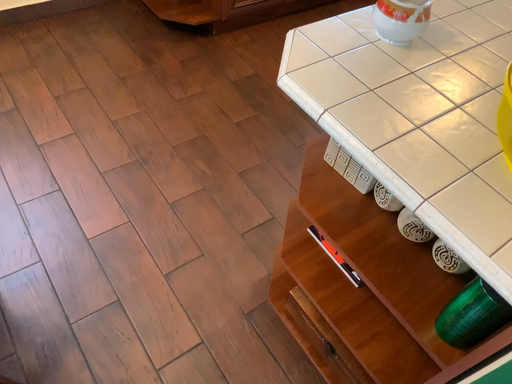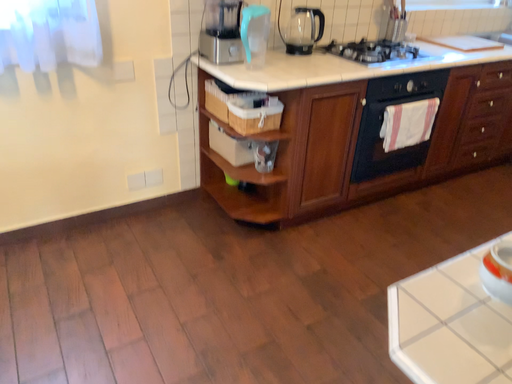
Question: How did the camera likely rotate when shooting the video?

Choices:
 (A) rotated right
 (B) rotated left

Answer: (B)